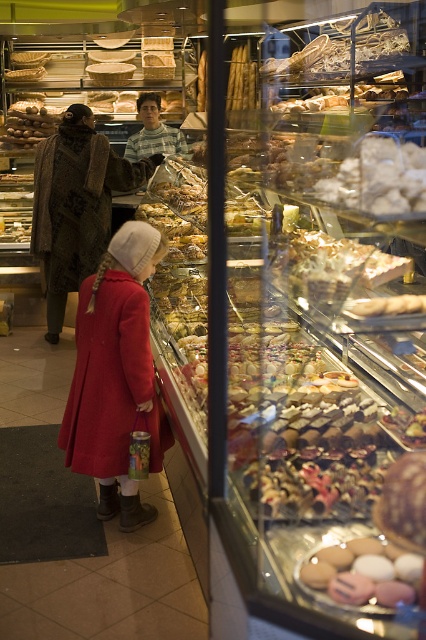
You are a photographer trying to capture a closeup of the matte pink macarons at center without including the brown textured coat at center in the shot. Based on their sizes, is this possible?

The brown textured coat at center is wider than the matte pink macarons at center, so it is possible to frame the photo to exclude the coat while focusing on the macarons.

You are a customer in the bakery looking at the display case. You see the brown textured coat at center and the matte pink macarons at center. Which object is positioned more to the left?

The brown textured coat at center is positioned to the left of the matte pink macarons at center, so the brown textured coat at center is more to the left.

You are a customer in the bakery and want to know if the matte red coat at center can fit into a small coat rack that can only hold coats narrower than the brown textured coat at center. Can it fit?

The matte red coat at center has a width less than the brown textured coat at center, so it can fit into the small coat rack designed for coats narrower than the brown textured coat at center.